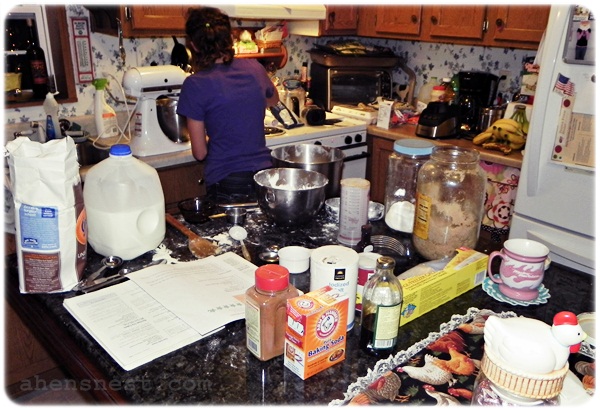
Find the location of a particular element. The height and width of the screenshot is (410, 600). thermometer is located at coordinates (82, 57).